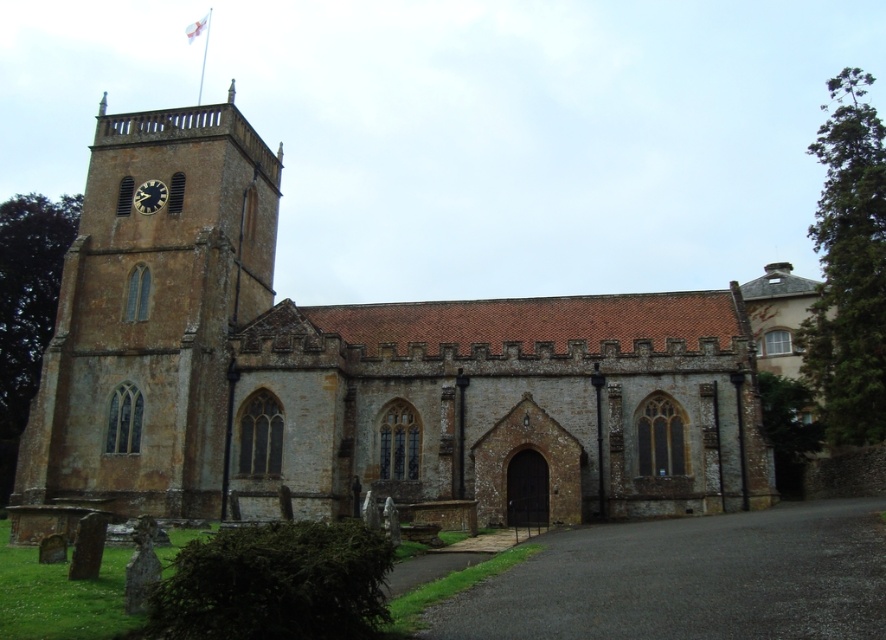
From the picture: Between brown stone church at center and matte black clock at upper left, which one has more height?

Standing taller between the two is brown stone church at center.

Does brown stone church at center appear over matte black clock at upper left?

A: Actually, brown stone church at center is below matte black clock at upper left.

Is point (154, 116) positioned in front of point (158, 188)?

No, it is not.

Locate an element on the screen. Image resolution: width=886 pixels, height=640 pixels. brown stone church at center is located at coordinates click(354, 371).

Between brown stone tower at center-left and matte black clock at upper left, which one is positioned higher?

matte black clock at upper left is above.

Is brown stone tower at center-left wider than matte black clock at upper left?

Correct, the width of brown stone tower at center-left exceeds that of matte black clock at upper left.

The height and width of the screenshot is (640, 886). Find the location of `brown stone tower at center-left`. brown stone tower at center-left is located at coordinates (149, 321).

Which is above, brown stone church at center or brown stone tower at center-left?

brown stone tower at center-left is above.

Does brown stone church at center have a greater width compared to brown stone tower at center-left?

Indeed, brown stone church at center has a greater width compared to brown stone tower at center-left.

Identify the location of brown stone church at center. (354, 371).